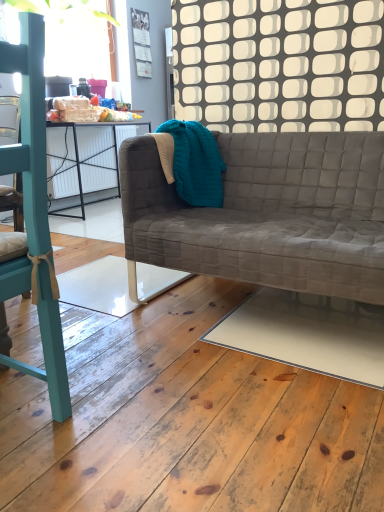
Question: Is teal painted wood chair at left at the back of white glossy plywood at lower center?

Choices:
 (A) no
 (B) yes

Answer: (A)

Question: Is white glossy plywood at lower center directly adjacent to teal painted wood chair at left?

Choices:
 (A) yes
 (B) no

Answer: (B)

Question: From the image's perspective, would you say white glossy plywood at lower center is shown under teal painted wood chair at left?

Choices:
 (A) yes
 (B) no

Answer: (A)

Question: Does white glossy plywood at lower center have a lesser width compared to teal painted wood chair at left?

Choices:
 (A) yes
 (B) no

Answer: (B)

Question: From a real-world perspective, is white glossy plywood at lower center positioned over teal painted wood chair at left based on gravity?

Choices:
 (A) yes
 (B) no

Answer: (B)

Question: Considering the relative positions of white glossy plywood at lower center and teal painted wood chair at left in the image provided, is white glossy plywood at lower center to the right of teal painted wood chair at left from the viewer's perspective?

Choices:
 (A) yes
 (B) no

Answer: (A)

Question: Could you tell me if matte paper calendar at upper center is turned towards teal knitted blanket at upper center?

Choices:
 (A) no
 (B) yes

Answer: (A)

Question: Can you confirm if matte paper calendar at upper center is smaller than teal knitted blanket at upper center?

Choices:
 (A) no
 (B) yes

Answer: (B)

Question: Is matte paper calendar at upper center bigger than teal knitted blanket at upper center?

Choices:
 (A) no
 (B) yes

Answer: (A)

Question: Is matte paper calendar at upper center shorter than teal knitted blanket at upper center?

Choices:
 (A) no
 (B) yes

Answer: (A)

Question: Considering the relative positions of matte paper calendar at upper center and teal knitted blanket at upper center in the image provided, is matte paper calendar at upper center in front of teal knitted blanket at upper center?

Choices:
 (A) no
 (B) yes

Answer: (A)

Question: Can you confirm if matte paper calendar at upper center is wider than teal knitted blanket at upper center?

Choices:
 (A) yes
 (B) no

Answer: (B)

Question: Can you confirm if white glossy plywood at lower center is taller than textured gray couch at center?

Choices:
 (A) no
 (B) yes

Answer: (A)